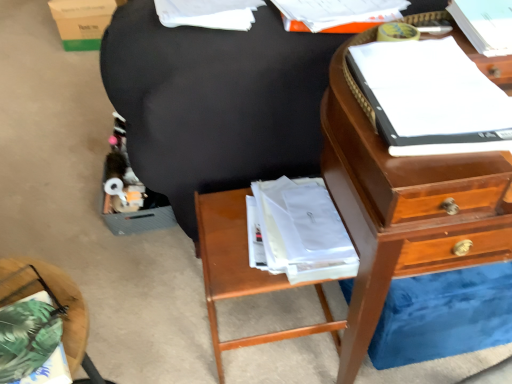
Question: Considering the relative positions of green fabric pillow at lower left, the first nightstand when ordered from left to right, and green cardboard box at upper left in the image provided, is green fabric pillow at lower left, the first nightstand when ordered from left to right, to the left of green cardboard box at upper left from the viewer's perspective?

Choices:
 (A) no
 (B) yes

Answer: (A)

Question: From a real-world perspective, is green fabric pillow at lower left, the first nightstand when ordered from left to right, below green cardboard box at upper left?

Choices:
 (A) no
 (B) yes

Answer: (A)

Question: Does green fabric pillow at lower left, the first nightstand from the front, have a lesser height compared to green cardboard box at upper left?

Choices:
 (A) yes
 (B) no

Answer: (A)

Question: Considering the relative positions of green fabric pillow at lower left, the first nightstand from the front, and green cardboard box at upper left in the image provided, is green fabric pillow at lower left, the first nightstand from the front, to the right of green cardboard box at upper left from the viewer's perspective?

Choices:
 (A) yes
 (B) no

Answer: (A)

Question: Is green fabric pillow at lower left, the first nightstand when ordered from left to right, next to green cardboard box at upper left and touching it?

Choices:
 (A) yes
 (B) no

Answer: (B)

Question: Which is correct: green cardboard box at upper left is inside wooden nightstand at lower center, which is the second nightstand from front to back, or outside of it?

Choices:
 (A) outside
 (B) inside

Answer: (A)

Question: From the image's perspective, is green cardboard box at upper left positioned above or below wooden nightstand at lower center, which ranks as the second nightstand in left-to-right order?

Choices:
 (A) below
 (B) above

Answer: (B)

Question: Based on their sizes in the image, would you say green cardboard box at upper left is bigger or smaller than wooden nightstand at lower center, which ranks as the second nightstand in left-to-right order?

Choices:
 (A) small
 (B) big

Answer: (A)

Question: Considering the positions of point (57, 19) and point (313, 327), is point (57, 19) closer or farther from the camera than point (313, 327)?

Choices:
 (A) closer
 (B) farther

Answer: (B)

Question: Is white paper at upper right, which is counted as the 3th book, starting from the left, bigger or smaller than green cardboard box at upper left?

Choices:
 (A) small
 (B) big

Answer: (A)

Question: Visually, is white paper at upper right, marked as the 1th book in a right-to-left arrangement, positioned to the left or to the right of green cardboard box at upper left?

Choices:
 (A) right
 (B) left

Answer: (A)

Question: In the image, is white paper at upper right, which is counted as the 3th book, starting from the left, positioned in front of or behind green cardboard box at upper left?

Choices:
 (A) behind
 (B) front

Answer: (B)

Question: Considering the positions of white paper at upper right, which is counted as the 3th book, starting from the left, and green cardboard box at upper left in the image, is white paper at upper right, which is counted as the 3th book, starting from the left, wider or thinner than green cardboard box at upper left?

Choices:
 (A) wide
 (B) thin

Answer: (B)

Question: Is wooden nightstand at lower center, positioned as the first nightstand in back-to-front order, wider or thinner than white paper at upper center, the third book in the right-to-left sequence?

Choices:
 (A) thin
 (B) wide

Answer: (B)

Question: Is wooden nightstand at lower center, the first nightstand viewed from the right, taller or shorter than white paper at upper center, marked as the first book in a left-to-right arrangement?

Choices:
 (A) tall
 (B) short

Answer: (A)